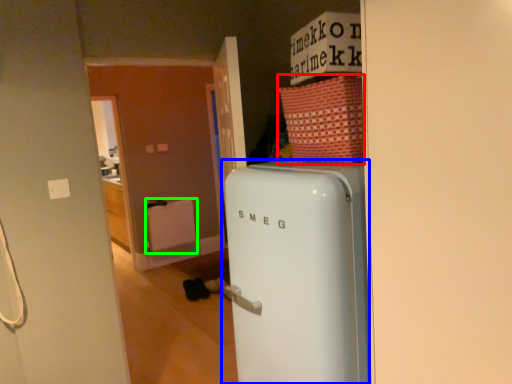
Question: Which object is positioned farthest from cardboard box (highlighted by a red box)? Select from refrigerator (highlighted by a blue box) and radiator (highlighted by a green box).

Choices:
 (A) refrigerator
 (B) radiator

Answer: (B)